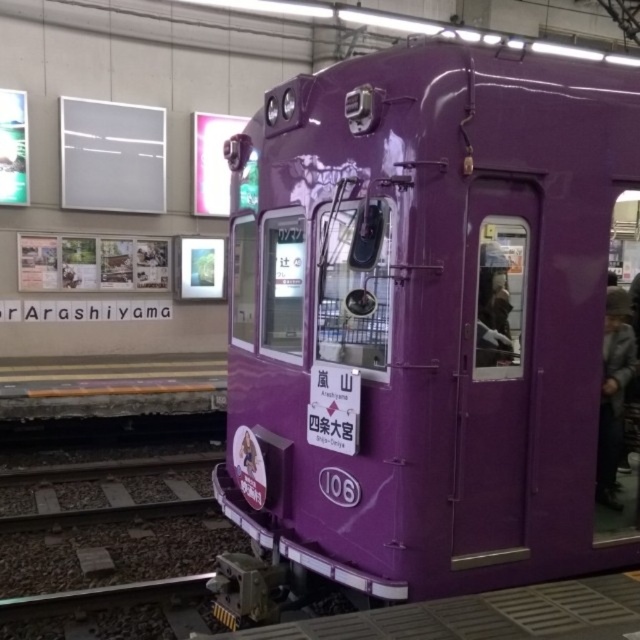
Is matte purple train at center positioned in front of dark gray fabric coat at right?

Yes, matte purple train at center is in front of dark gray fabric coat at right.

Does matte purple train at center appear on the right side of dark gray fabric coat at right?

No, matte purple train at center is not to the right of dark gray fabric coat at right.

Which is in front, point (320, 225) or point (609, 390)?

Positioned in front is point (320, 225).

Image resolution: width=640 pixels, height=640 pixels. I want to click on matte purple train at center, so (422, 324).